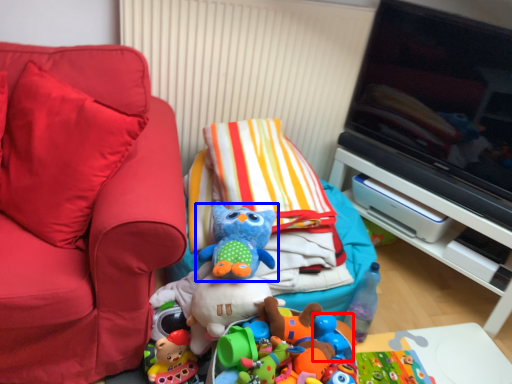
Question: Which of the following is the closest to the observer, toy (highlighted by a red box) or toy (highlighted by a blue box)?

Choices:
 (A) toy
 (B) toy

Answer: (B)